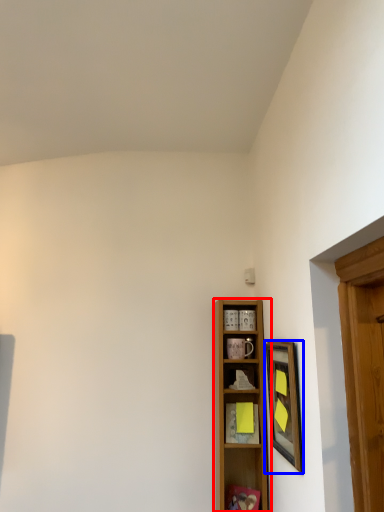
Question: Among these objects, which one is farthest to the camera, shelf (highlighted by a red box) or picture frame (highlighted by a blue box)?

Choices:
 (A) shelf
 (B) picture frame

Answer: (A)